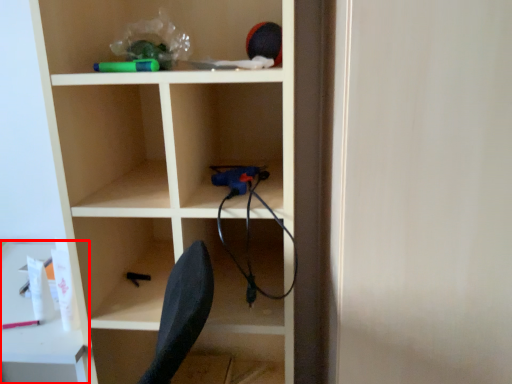
Question: From the image's perspective, what is the correct spatial relationship of table (annotated by the red box) in relation to shelf?

Choices:
 (A) above
 (B) below

Answer: (B)